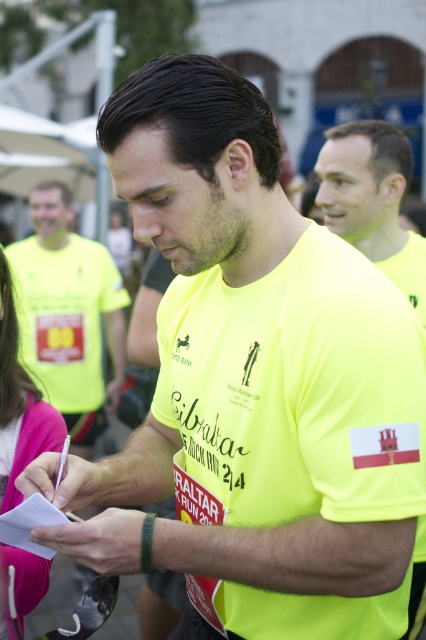
Question: Does neon yellow t-shirt at center have a greater width compared to pink fabric at lower left?

Choices:
 (A) no
 (B) yes

Answer: (B)

Question: Which point is closer to the camera taking this photo?

Choices:
 (A) (31, 412)
 (B) (336, 173)

Answer: (A)

Question: Which is farther from the yellow matte shirt at upper center?

Choices:
 (A) neon yellow t-shirt at center
 (B) pink fabric at lower left

Answer: (A)

Question: Which point is closer to the camera?

Choices:
 (A) (394, 244)
 (B) (22, 422)
 (C) (94, 372)

Answer: (B)

Question: Where is neon yellow t-shirt at center located in relation to yellow matte shirt at upper center in the image?

Choices:
 (A) left
 (B) right

Answer: (A)

Question: Is neon yellow t-shirt at center bigger than pink fabric at lower left?

Choices:
 (A) yes
 (B) no

Answer: (A)